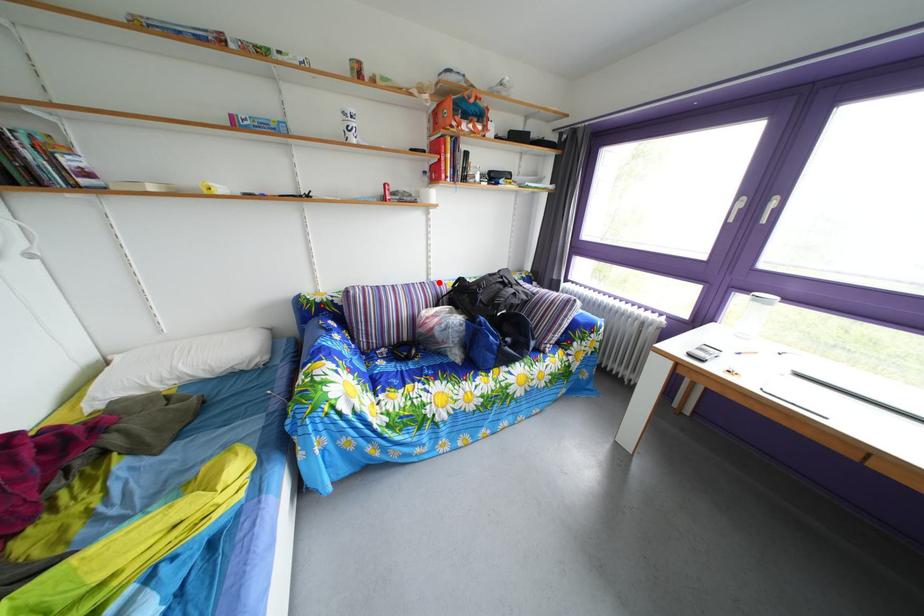
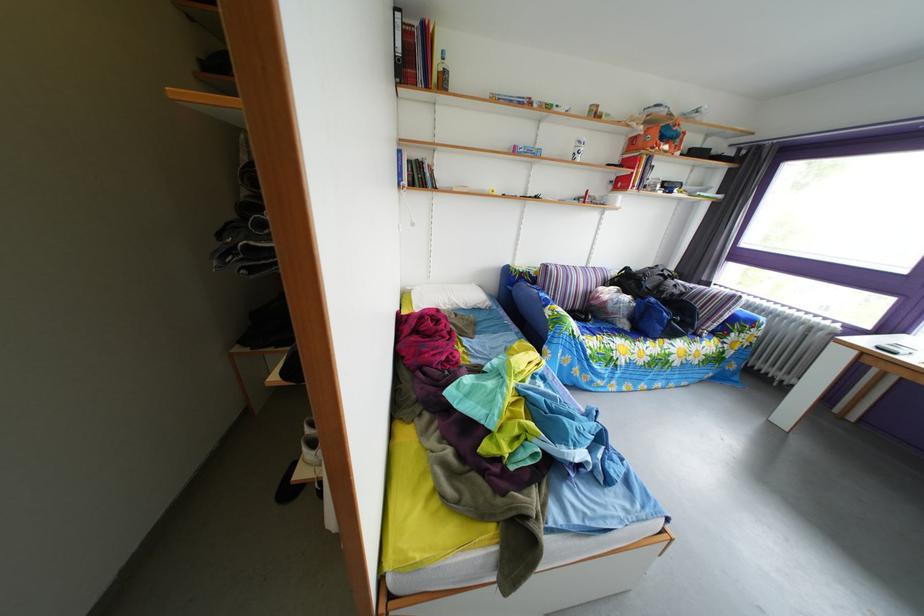
The point at the highlighted location is marked in the first image. Where is the corresponding point in the second image?

(599, 270)